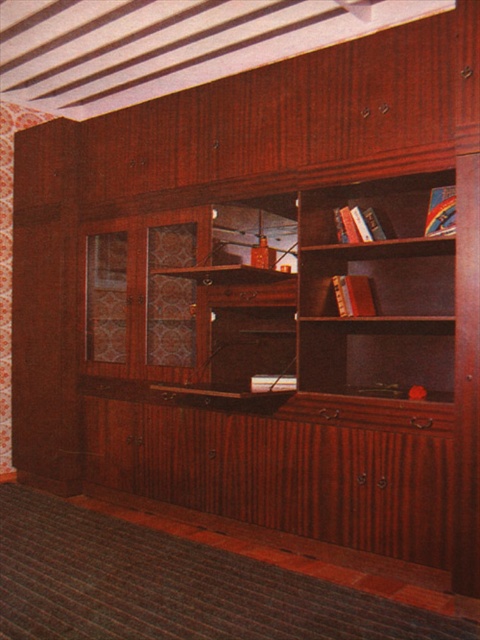
Is wooden bookshelf at center positioned behind wooden bookshelf at upper right?

No, it is not.

From the picture: Which is below, wooden bookshelf at center or wooden bookshelf at upper right?

Positioned lower is wooden bookshelf at center.

Does point (299, 211) lie in front of point (407, 230)?

Yes, it is.

The image size is (480, 640). Find the location of `wooden bookshelf at center`. wooden bookshelf at center is located at coordinates (376, 292).